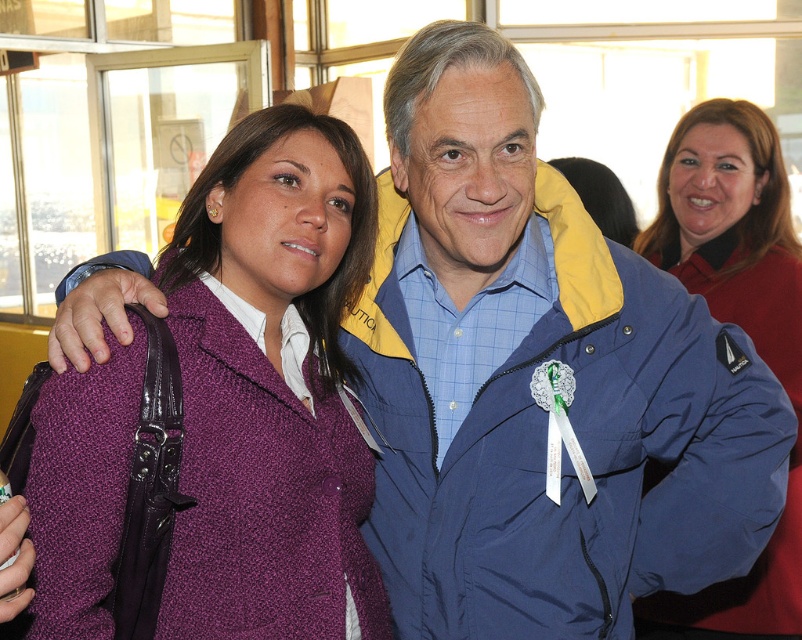
Question: Which of the following is the closest to the observer?

Choices:
 (A) (683, 243)
 (B) (128, 522)

Answer: (B)

Question: Can you confirm if matte red shirt at upper right is smaller than purple fleece jacket at left?

Choices:
 (A) yes
 (B) no

Answer: (B)

Question: Which point is farther to the camera?

Choices:
 (A) purple fleece jacket at left
 (B) matte red shirt at upper right

Answer: (B)

Question: Does matte red shirt at upper right appear on the right side of purple fleece jacket at left?

Choices:
 (A) yes
 (B) no

Answer: (A)

Question: Does matte red shirt at upper right have a larger size compared to purple fleece jacket at left?

Choices:
 (A) no
 (B) yes

Answer: (B)